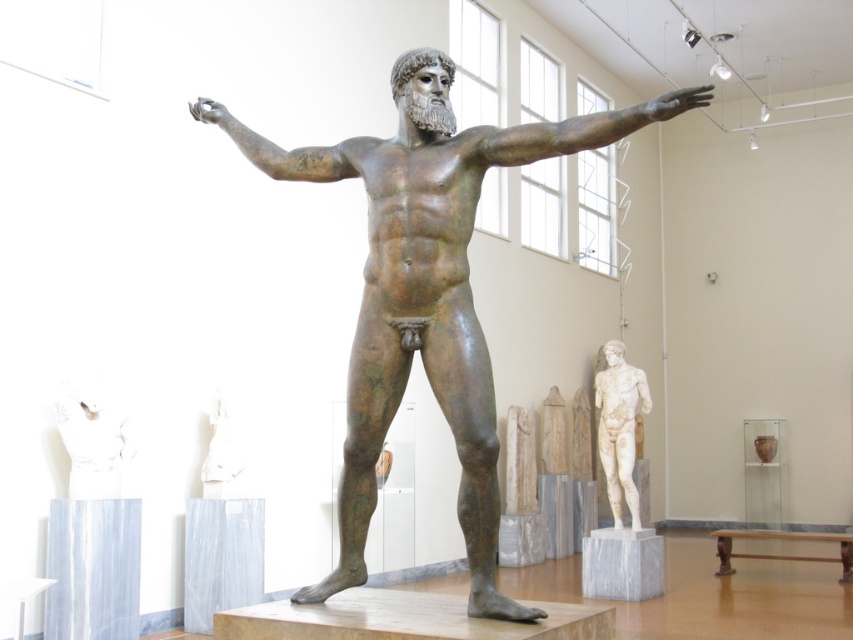
You are an art student standing in front of the museum display. You notice the bronze statue at center and the white marble statue at center. Which one is placed higher up?

The bronze statue at center is positioned over the white marble statue at center, so it is placed higher up.

You are a tour guide leading a group through the museum. You want to ensure visitors can comfortably walk between the bronze statue at center and the white marble statue at center. The path between them is 1.2 meters wide. Can visitors walk through this path comfortably?

The path between the bronze statue at center and the white marble statue at center is 1.2 meters wide. Since the average person is about 0.5 meters wide, visitors can comfortably walk through this path without difficulty.

You are an art student standing in front of the bronze statue. You notice two white marble sculptures in the background. Which one is closer to you, the white marble torso at center or the white marble statue at center?

The white marble torso at center is closer to the viewer than the white marble statue at center.